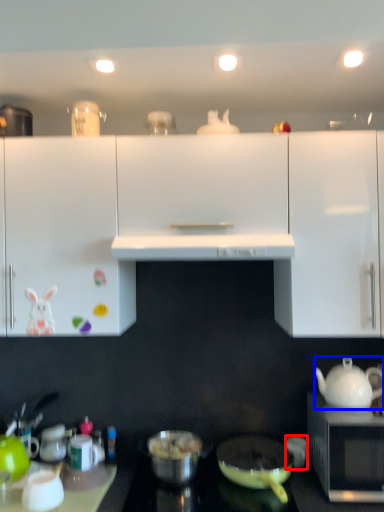
Question: Which object appears closest to the camera in this image, coffee cup (highlighted by a red box) or teapot (highlighted by a blue box)?

Choices:
 (A) coffee cup
 (B) teapot

Answer: (B)